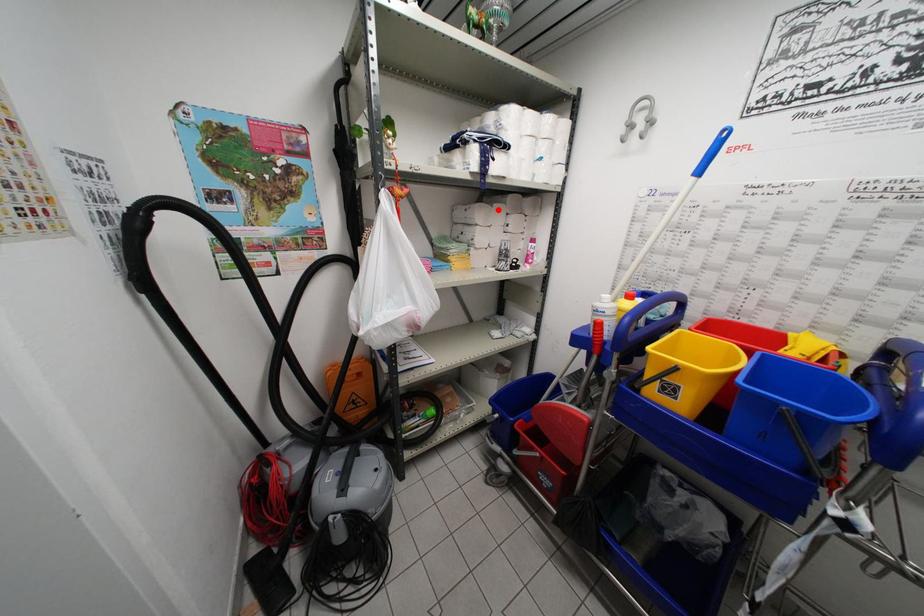
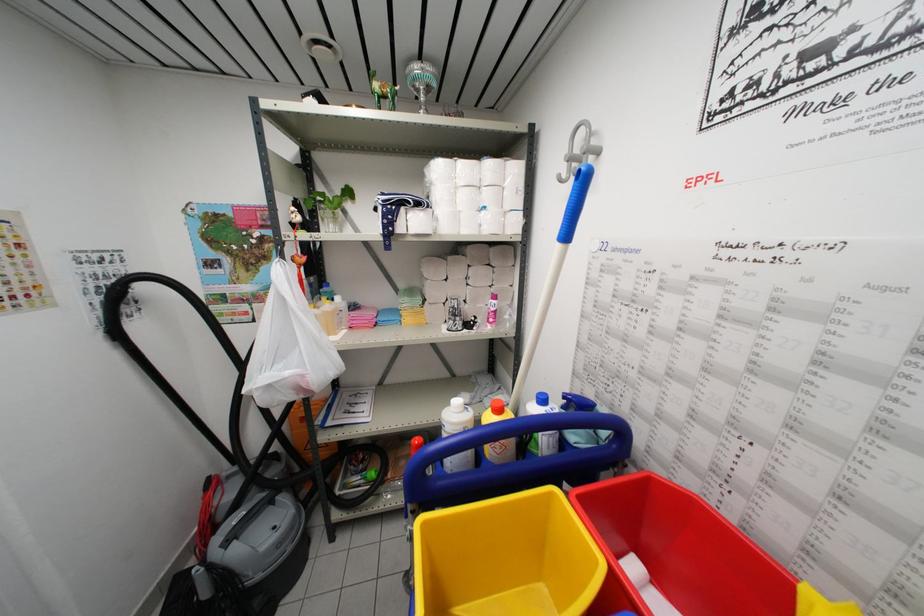
Where in the second image is the point corresponding to the highlighted location from the first image?

(453, 262)